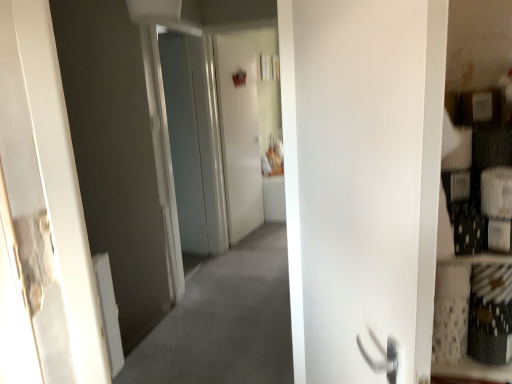
Question: From their relative heights in the image, would you say white matte door at right is taller or shorter than transparent glass door at center, which appears as the second screen door when viewed from the right?

Choices:
 (A) tall
 (B) short

Answer: (B)

Question: Is white matte door at right to the left or to the right of transparent glass door at center, which appears as the second screen door when viewed from the right, in the image?

Choices:
 (A) left
 (B) right

Answer: (B)

Question: Which of these objects is positioned farthest from the white matte door at right?

Choices:
 (A) white glossy door at center, which is counted as the 1th screen door, starting from the right
 (B) transparent glass door at center, which appears as the second screen door when viewed from the right

Answer: (A)

Question: Estimate the real-world distances between objects in this image. Which object is closer to the white matte door at right?

Choices:
 (A) transparent glass door at center, arranged as the 1th screen door when viewed from the left
 (B) white glossy door at center, which is counted as the 1th screen door, starting from the right

Answer: (A)